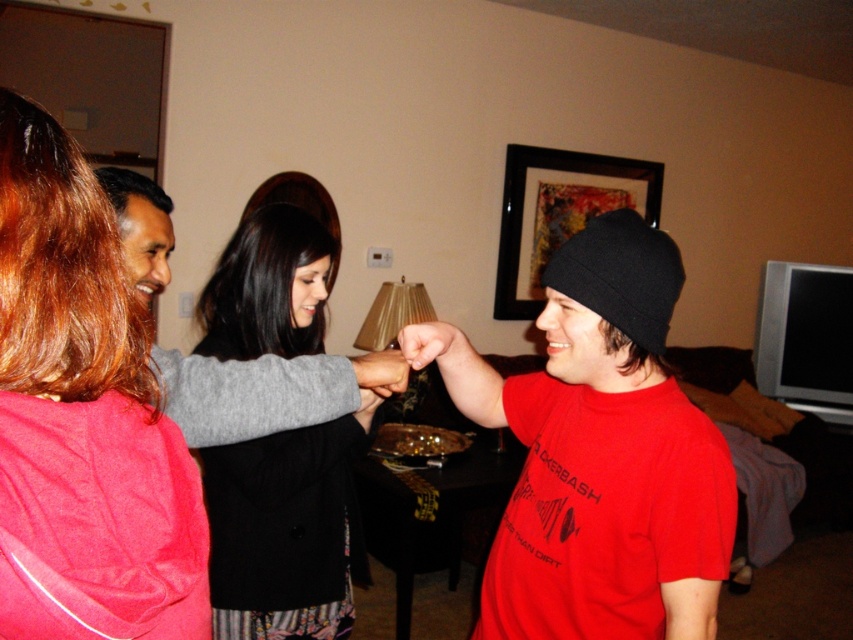
Question: Estimate the real-world distances between objects in this image. Which object is closer to the red matte beanie at center?

Choices:
 (A) smooth skin hand at center
 (B) matte black hand at center

Answer: (A)

Question: Which point is closer to the camera?

Choices:
 (A) (363, 365)
 (B) (202, 320)

Answer: (A)

Question: Is red matte beanie at center wider than matte pink hoodie at upper left?

Choices:
 (A) no
 (B) yes

Answer: (B)

Question: Can you confirm if red matte beanie at center is positioned to the right of matte black hand at center?

Choices:
 (A) yes
 (B) no

Answer: (A)

Question: Which is nearer to the matte pink hoodie at upper left?

Choices:
 (A) matte black hand at center
 (B) red matte beanie at center
 (C) black matte jacket at center

Answer: (A)

Question: Does matte pink hoodie at upper left have a smaller size compared to black matte jacket at center?

Choices:
 (A) yes
 (B) no

Answer: (A)